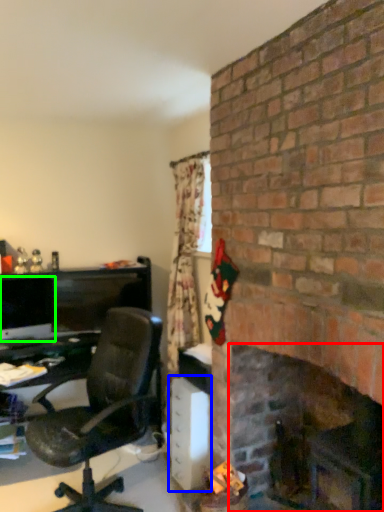
Question: Considering the real-world distances, which object is farthest from fireplace (highlighted by a red box)? file cabinet (highlighted by a blue box) or computer monitor (highlighted by a green box)?

Choices:
 (A) file cabinet
 (B) computer monitor

Answer: (B)